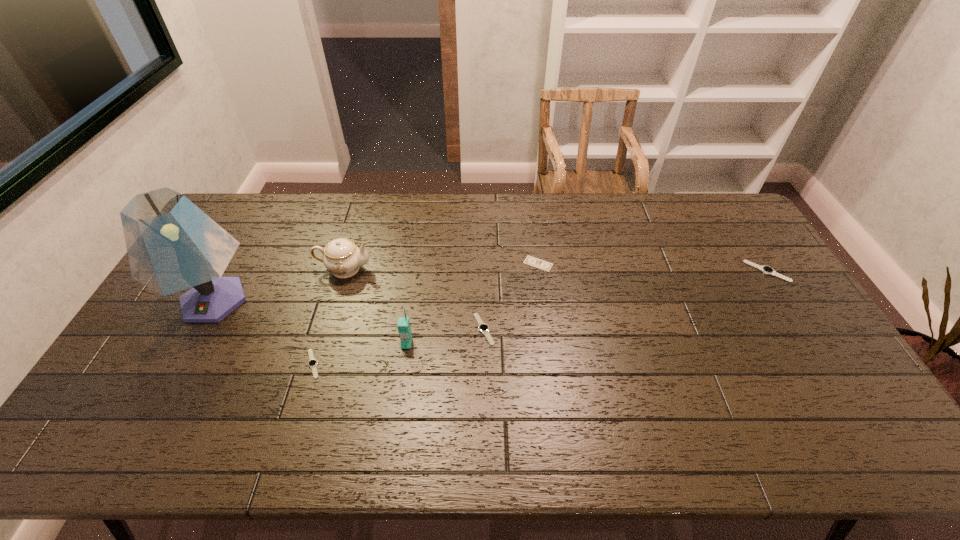
To make them evenly spaced by inserting another watch among them, please locate a free space for this new watch. Please provide its 2D coordinates. Your answer should be formatted as a tuple, i.e. [(x, y)], where the tuple contains the x and y coordinates of a point satisfying the conditions above.

[(634, 299)]